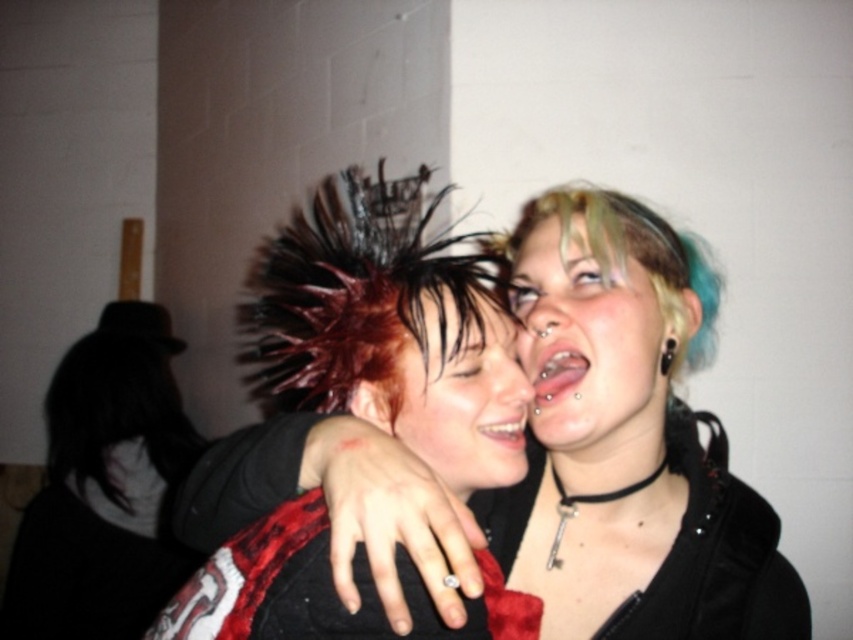
From the picture: You are a photographer setting up a shoot. You have a matte black jacket at center and a shiny silver necklace at upper right in the frame. You need to ensure that the distance between them is at least 10 centimeters to avoid overlapping in the photo. Based on the scene provided, will the current positioning work?

The distance between the matte black jacket at center and the shiny silver necklace at upper right is 8.14 centimeters, which is less than the required 10 centimeters. Therefore, the current positioning may cause overlapping in the photo.

You are a photographer standing at point (672, 483). You want to capture a photo of the two people in the image. Considering their current distance, is it possible to include both individuals in the frame without zooming out?

The two people are 31.12 inches apart. Since the photographer is at point (672, 483), which is the midpoint between them, the distance between them is within a typical camera frame without needing to zoom out. Therefore, both individuals can be captured in the frame.

You are standing at the point marked as point (370,259) in the image. You want to reach the person on the right without getting too close to them. The minimum safe distance you can maintain is 24 inches. Can you do this?

The distance between you and the viewer is 28.05 inches, which is greater than the minimum safe distance of 24 inches. Yes, you can reach the person on the right while maintaining the required distance.